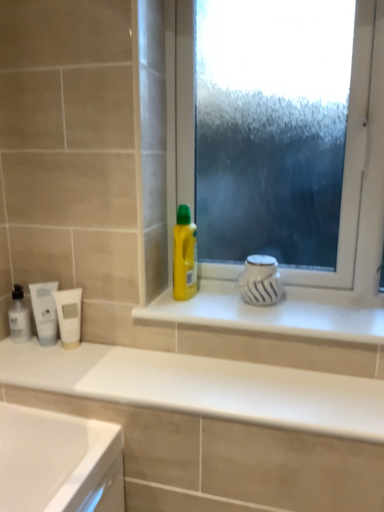
Where is `free spot in front of white matte tube at lower left, which is the third mouthwash in left-to-right order`? The image size is (384, 512). free spot in front of white matte tube at lower left, which is the third mouthwash in left-to-right order is located at coordinates (63, 371).